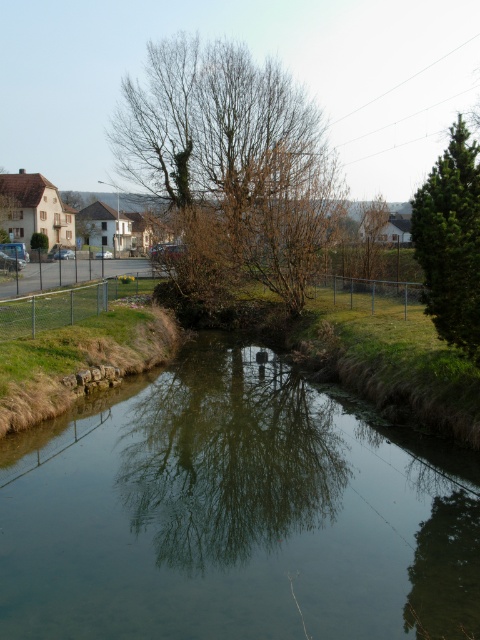
Between bare brown tree at center and green textured pine tree at right, which one has less height?

With less height is bare brown tree at center.

Which is in front, point (283, 163) or point (467, 230)?

Point (467, 230) is more forward.

At what (x,y) coordinates should I click in order to perform the action: click on bare brown tree at center. Please return your answer as a coordinate pair (x, y). Looking at the image, I should click on (232, 160).